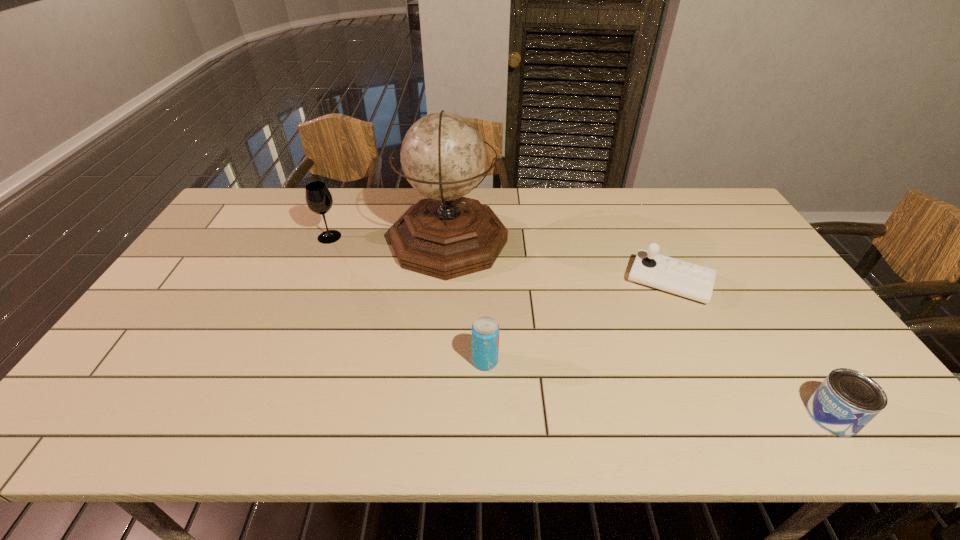
This screenshot has width=960, height=540. In the image, there is a desktop. In order to click on vacant space at the left edge in this screenshot , I will do (194, 273).

In the image, there is a desktop. At what (x,y) coordinates should I click in order to perform the action: click on vacant area at the far left corner. Please return your answer as a coordinate pair (x, y). The image size is (960, 540). Looking at the image, I should click on (243, 198).

At what (x,y) coordinates should I click in order to perform the action: click on vacant space at the near left corner. Please return your answer as a coordinate pair (x, y). This screenshot has height=540, width=960. Looking at the image, I should click on (116, 406).

The height and width of the screenshot is (540, 960). In order to click on free area in between the wineglass and the nearest object in this screenshot , I will do `click(581, 326)`.

The height and width of the screenshot is (540, 960). I want to click on vacant area between the nearest object and the leftmost object, so click(581, 326).

Locate an element on the screen. The width and height of the screenshot is (960, 540). free spot between the globe and the fourth object from left to right is located at coordinates (559, 261).

Where is `empty space that is in between the second object from right to left and the leftmost object`? empty space that is in between the second object from right to left and the leftmost object is located at coordinates (499, 259).

Where is `vacant region between the soda can and the fourth object from left to right`? The width and height of the screenshot is (960, 540). vacant region between the soda can and the fourth object from left to right is located at coordinates (577, 322).

At what (x,y) coordinates should I click in order to perform the action: click on free space between the soda can and the wineglass. Please return your answer as a coordinate pair (x, y). This screenshot has width=960, height=540. Looking at the image, I should click on (407, 299).

Image resolution: width=960 pixels, height=540 pixels. In order to click on vacant space that's between the fourth object from left to right and the globe in this screenshot , I will do coord(559,261).